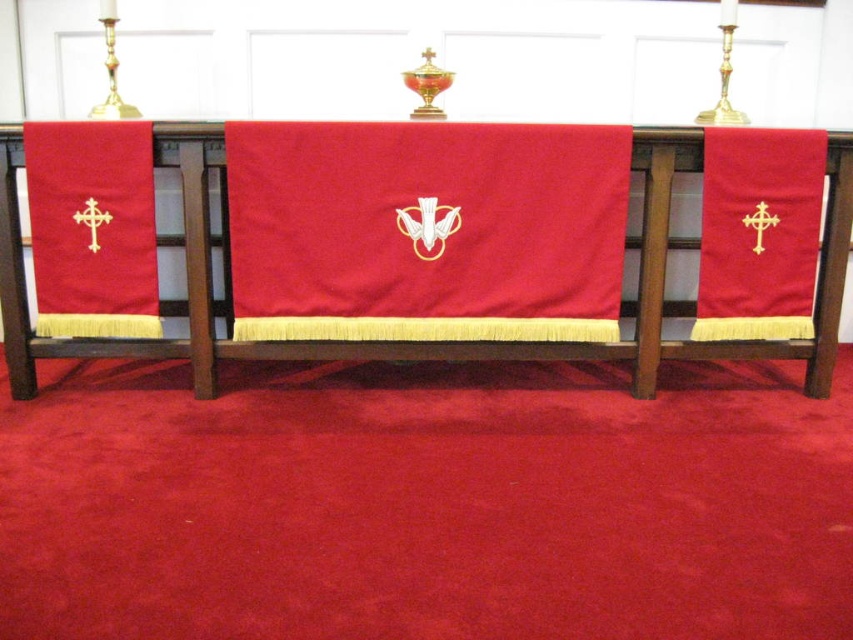
Is matte red cloth at center bigger than matte gold cross at right?

Correct, matte red cloth at center is larger in size than matte gold cross at right.

Which is above, matte red cloth at center or matte gold cross at right?

matte gold cross at right

Is point (315, 257) positioned behind point (708, 280)?

No, (315, 257) is in front of (708, 280).

Locate an element on the screen. matte red cloth at center is located at coordinates (426, 230).

Who is positioned more to the right, matte red cloth at center or matte red fabric cross at left?

Positioned to the right is matte red cloth at center.

Does point (305, 129) lie in front of point (144, 244)?

Yes, it is.

You are a GUI agent. You are given a task and a screenshot of the screen. Output one action in this format:
    pyautogui.click(x=<x>, y=<y>)
    Task: Click on the matte red cloth at center
    This screenshot has height=640, width=853.
    Given the screenshot: What is the action you would take?
    pyautogui.click(x=426, y=230)

Can you confirm if matte red fabric cross at left is shorter than matte gold cross at right?

Yes.

Does matte red fabric cross at left appear over matte gold cross at right?

Actually, matte red fabric cross at left is below matte gold cross at right.

Does point (106, 150) lie behind point (711, 252)?

No, (106, 150) is closer to viewer.

Locate an element on the screen. matte red fabric cross at left is located at coordinates (91, 228).